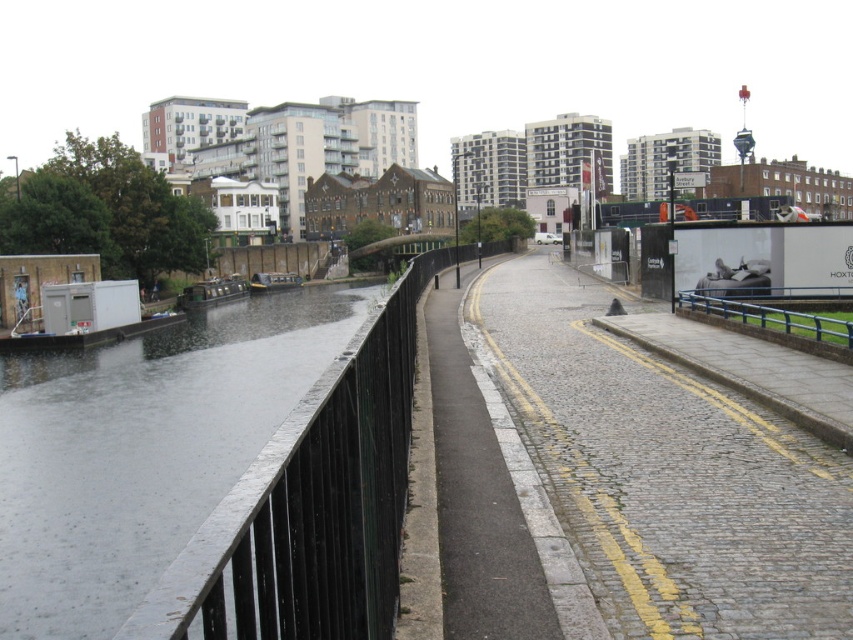
You are a pedestrian walking along the paved pathway and notice the black metal fence at left and the green matte canal boat at left. Which object is closer to the pathway?

The black metal fence at left is closer to the pathway because it is positioned to the right of the green matte canal boat at left, meaning it is nearer to the path.

You are standing on the paved pathway and want to locate the black metal fence at left. According to the scene description, where would you find it in terms of direction?

The black metal fence at left is located to the left side of the paved pathway as per the scene description.

You are a pedestrian standing on the paved pathway. You want to walk towards the green matte boat at left. Which direction should you turn to face the blue metallic rail at right?

The blue metallic rail at right is to the right of the green matte boat at left. If you want to face the blue metallic rail at right, you should turn to your right side.